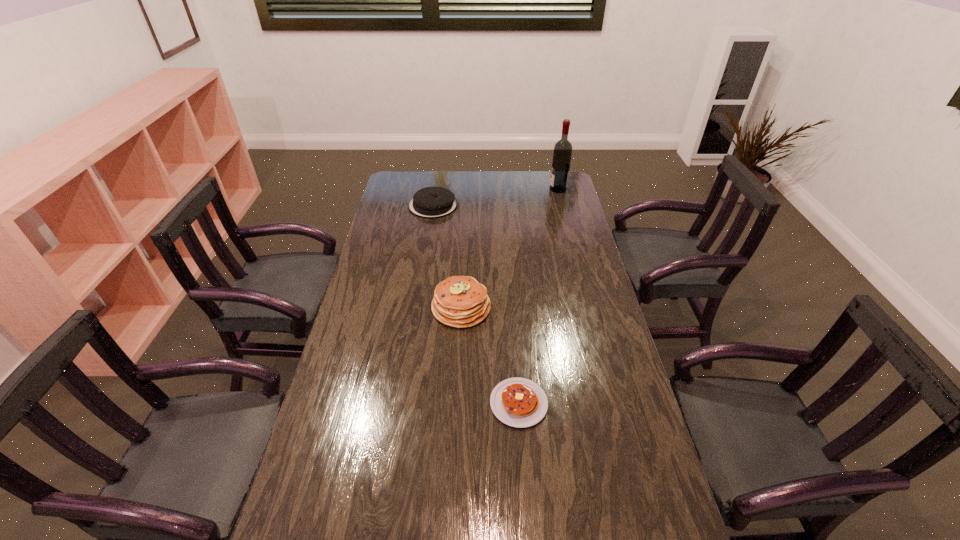
Locate an element on the screen. This screenshot has width=960, height=540. vacant space that's between the rightmost object and the shortest pancake is located at coordinates (539, 296).

You are a GUI agent. You are given a task and a screenshot of the screen. Output one action in this format:
    pyautogui.click(x=<x>, y=<y>)
    Task: Click on the free space between the tallest object and the shortest pancake
    This screenshot has width=960, height=540.
    Given the screenshot: What is the action you would take?
    pyautogui.click(x=539, y=296)

Identify the location of vacant point located between the tallest object and the nearest object. The height and width of the screenshot is (540, 960). (539, 296).

Identify which object is the closest to the nearest pancake. Please provide its 2D coordinates. Your answer should be formatted as a tuple, i.e. [(x, y)], where the tuple contains the x and y coordinates of a point satisfying the conditions above.

[(459, 301)]

Where is `the third closest object relative to the second farthest pancake`? This screenshot has width=960, height=540. the third closest object relative to the second farthest pancake is located at coordinates (562, 153).

Point out which pancake is positioned as the nearest to the third farthest object. Please provide its 2D coordinates. Your answer should be formatted as a tuple, i.e. [(x, y)], where the tuple contains the x and y coordinates of a point satisfying the conditions above.

[(518, 402)]

Locate an element on the screen. pancake that is the closest to the tallest object is located at coordinates (430, 202).

The image size is (960, 540). I want to click on blank space that satisfies the following two spatial constraints: 1. on the front side of the second farthest pancake; 2. on the left side of the shortest pancake, so (457, 403).

Where is `vacant region that satisfies the following two spatial constraints: 1. on the front and back of the alcohol; 2. on the front side of the third tallest object`? vacant region that satisfies the following two spatial constraints: 1. on the front and back of the alcohol; 2. on the front side of the third tallest object is located at coordinates (563, 206).

Locate an element on the screen. This screenshot has height=540, width=960. free space that satisfies the following two spatial constraints: 1. on the front side of the farthest pancake; 2. on the right side of the nearest pancake is located at coordinates (403, 403).